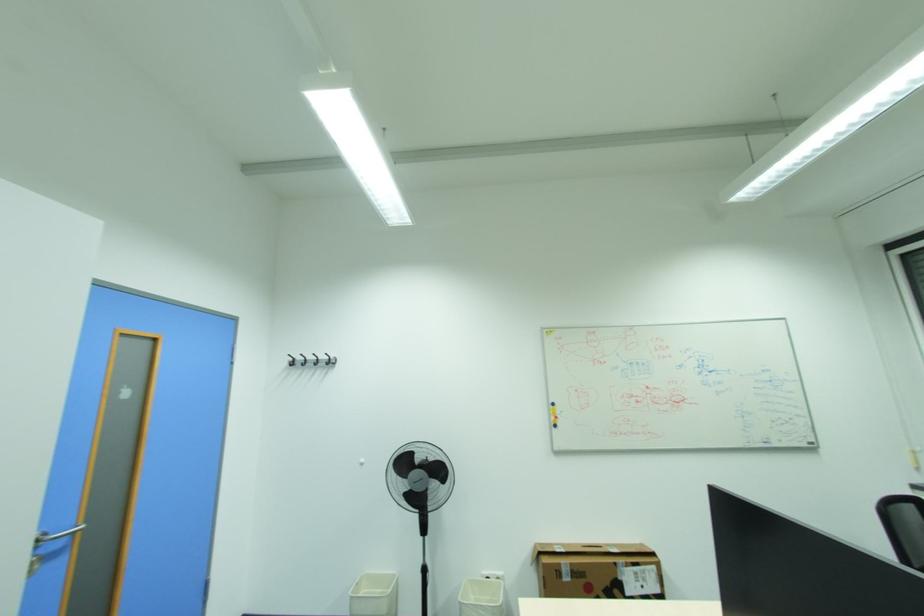
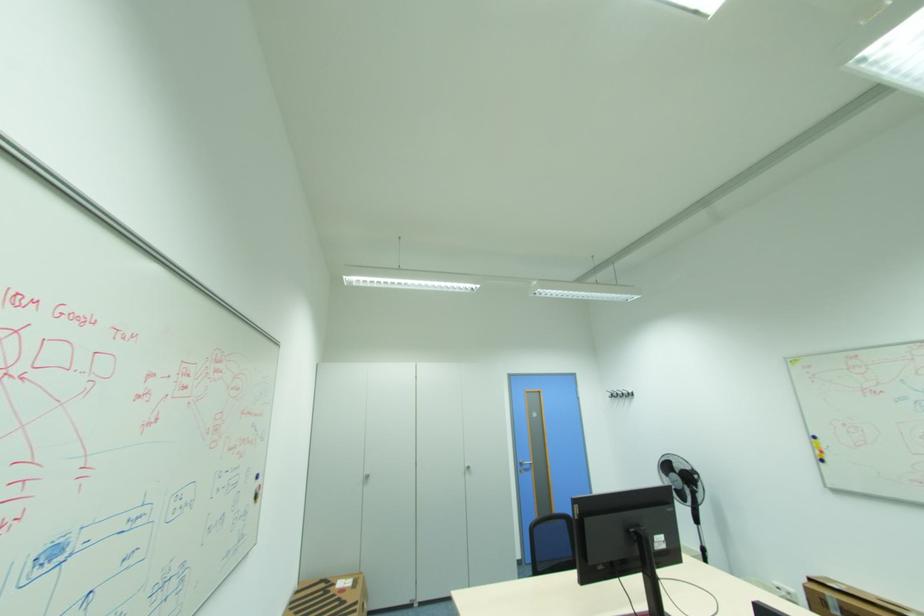
Where in the second image is the point corresponding to point (295, 355) from the first image?

(613, 391)